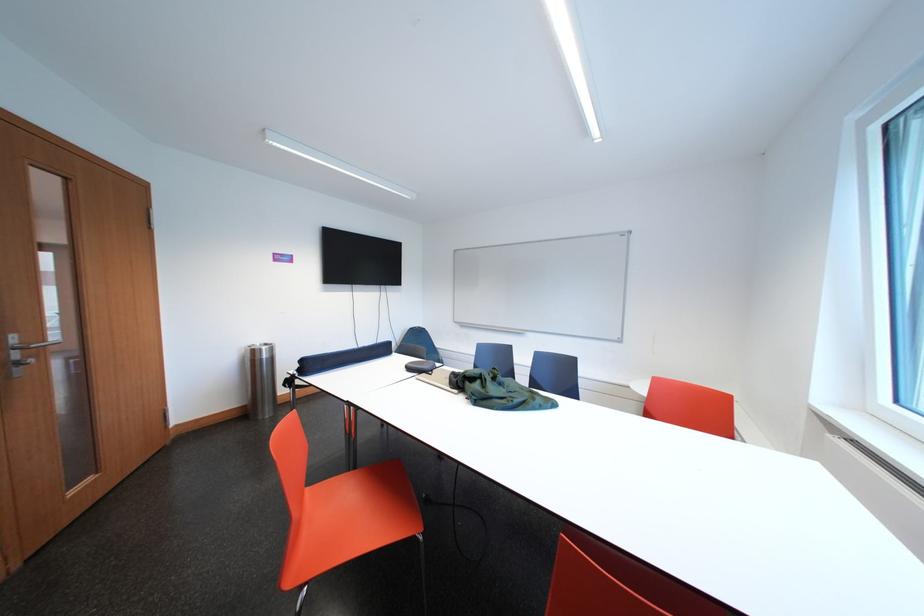
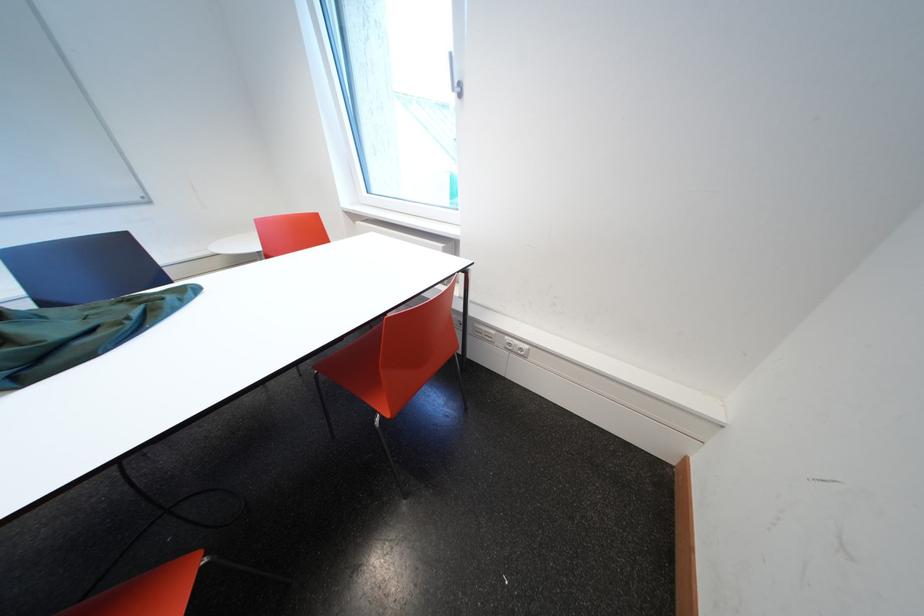
The images are taken continuously from a first-person perspective. In which direction is your viewpoint rotating?

The camera rotated toward right-down.